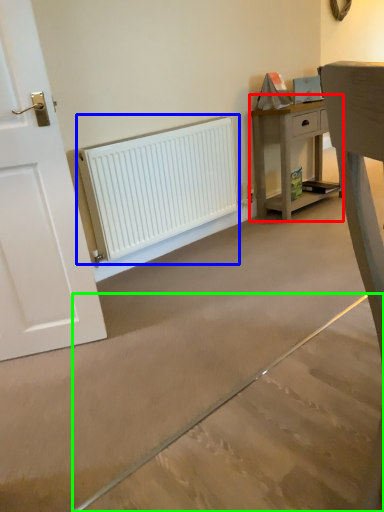
Question: Which is farther away from nightstand (highlighted by a red box)? radiator (highlighted by a blue box) or concrete (highlighted by a green box)?

Choices:
 (A) radiator
 (B) concrete

Answer: (B)